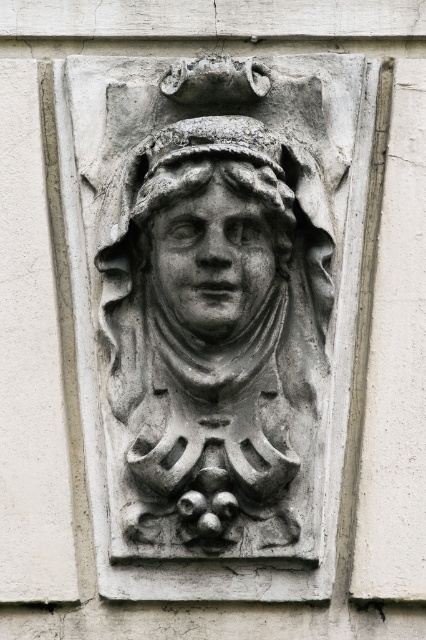
Based on the scene description, which object is taller, the gray stone carving at center or the gray stone face at center?

The gray stone carving at center is taller than the gray stone face at center according to the description.

You are an art conservator examining the stone relief sculpture. You need to determine the spatial relationship between the gray stone carving at center and the gray stone face at center. Which one is positioned lower on the sculpture?

The gray stone carving at center is positioned below the gray stone face at center, so it is lower on the sculpture.